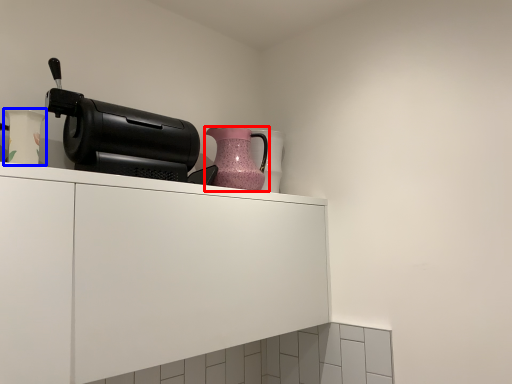
Question: Which object is closer to the camera taking this photo, jug (highlighted by a red box) or vase (highlighted by a blue box)?

Choices:
 (A) jug
 (B) vase

Answer: (B)